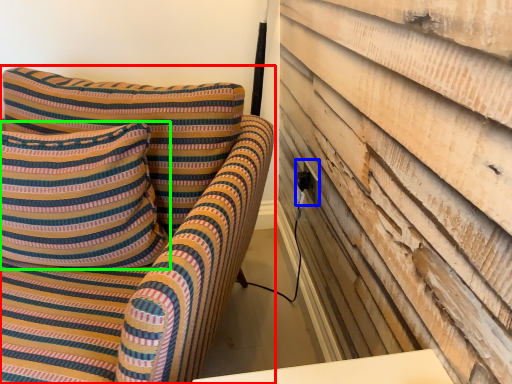
Question: Which object is positioned farthest from furniture (highlighted by a red box)? Select from electric outlet (highlighted by a blue box) and pillow (highlighted by a green box).

Choices:
 (A) electric outlet
 (B) pillow

Answer: (A)